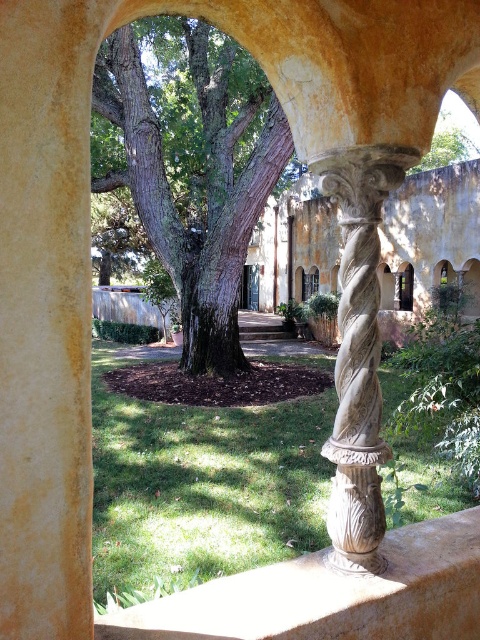
Question: Is green rough bark tree at center closer to the viewer compared to green leafy tree at upper center?

Choices:
 (A) yes
 (B) no

Answer: (B)

Question: Can you confirm if green rough bark tree at center is thinner than smooth stone ledge at center?

Choices:
 (A) no
 (B) yes

Answer: (B)

Question: Estimate the real-world distances between objects in this image. Which object is closer to the green leafy tree at upper center?

Choices:
 (A) smooth stone ledge at center
 (B) carved stone column at center
 (C) green rough bark tree at center

Answer: (A)

Question: Is smooth stone ledge at center bigger than carved stone column at center?

Choices:
 (A) no
 (B) yes

Answer: (B)

Question: Which point is farther to the camera?

Choices:
 (A) smooth stone ledge at center
 (B) green leafy tree at upper center
 (C) green rough bark tree at center
 (D) carved stone column at center

Answer: (C)

Question: Which point is farther to the camera?

Choices:
 (A) green rough bark tree at center
 (B) green leafy tree at upper center

Answer: (A)